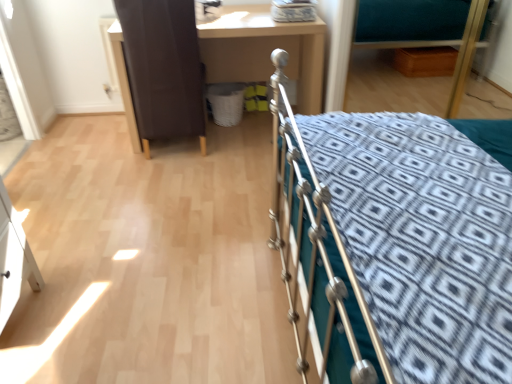
Where is `vacant space to the left of brown leather screen door at upper left`? Image resolution: width=512 pixels, height=384 pixels. vacant space to the left of brown leather screen door at upper left is located at coordinates (106, 140).